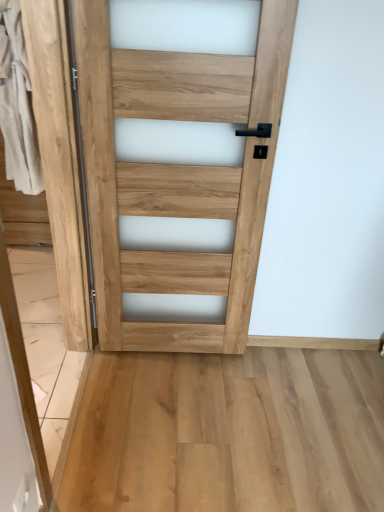
I want to click on natural wood door at center, so click(177, 173).

Describe the element at coordinates (177, 173) in the screenshot. This screenshot has height=512, width=384. I see `natural wood door at center` at that location.

This screenshot has height=512, width=384. What are the coordinates of `natural wood barn door at center` in the screenshot? It's located at (60, 162).

The height and width of the screenshot is (512, 384). What do you see at coordinates (60, 162) in the screenshot? I see `natural wood barn door at center` at bounding box center [60, 162].

In order to face natural wood barn door at center, should I rotate leftwards or rightwards?

Turn left by 19.300 degrees to look at natural wood barn door at center.

Identify the location of natural wood door at center. Image resolution: width=384 pixels, height=512 pixels. (177, 173).

Which is more to the left, natural wood barn door at center or natural wood door at center?

Positioned to the left is natural wood barn door at center.

Relative to natural wood door at center, is natural wood barn door at center in front or behind?

In the image, natural wood barn door at center appears in front of natural wood door at center.

Between point (56, 201) and point (142, 268), which one is positioned behind?

The point (142, 268) is farther from the camera.

From the image's perspective, would you say natural wood barn door at center is positioned over natural wood door at center?

No, from the image's perspective, natural wood barn door at center is not over natural wood door at center.

From a real-world perspective, is natural wood barn door at center positioned over natural wood door at center based on gravity?

No, from a real-world perspective, natural wood barn door at center is not on top of natural wood door at center.

Consider the image. Which object is thinner, natural wood barn door at center or natural wood door at center?

natural wood door at center.

Which of these two, natural wood barn door at center or natural wood door at center, stands taller?

Standing taller between the two is natural wood door at center.

Considering the relative sizes of natural wood barn door at center and natural wood door at center in the image provided, is natural wood barn door at center smaller than natural wood door at center?

No.

Is natural wood barn door at center not within natural wood door at center?

natural wood barn door at center is positioned outside natural wood door at center.

Would you consider natural wood barn door at center to be distant from natural wood door at center?

natural wood barn door at center is near natural wood door at center, not far away.

Could you tell me if natural wood barn door at center is facing natural wood door at center?

Yes, natural wood barn door at center is oriented towards natural wood door at center.

What's the angular difference between natural wood barn door at center and natural wood door at center's facing directions?

88.6 degrees.

Find the location of a particular element. The height and width of the screenshot is (512, 384). barn door in front of the natural wood door at center is located at coordinates [60, 162].

Which object is positioned more to the right, natural wood door at center or natural wood barn door at center?

natural wood door at center is more to the right.

Is the position of natural wood door at center more distant than that of natural wood barn door at center?

Yes, natural wood door at center is behind natural wood barn door at center.

Which is less distant, (113, 278) or (49, 10)?

The point (49, 10) is more forward.

From the image's perspective, is natural wood door at center located above or below natural wood barn door at center?

Based on their image positions, natural wood door at center is located above natural wood barn door at center.

In the scene shown: From a real-world perspective, is natural wood door at center on top of natural wood barn door at center?

Correct, in the physical world, natural wood door at center is higher than natural wood barn door at center.

Can you confirm if natural wood door at center is thinner than natural wood barn door at center?

Yes.

Considering the sizes of objects natural wood door at center and natural wood barn door at center in the image provided, who is taller, natural wood door at center or natural wood barn door at center?

With more height is natural wood door at center.

Considering the sizes of objects natural wood door at center and natural wood barn door at center in the image provided, who is smaller, natural wood door at center or natural wood barn door at center?

Smaller between the two is natural wood door at center.

Which is correct: natural wood door at center is inside natural wood barn door at center, or outside of it?

natural wood door at center cannot be found inside natural wood barn door at center.

Is natural wood door at center next to natural wood barn door at center and touching it?

No, natural wood door at center is not next to natural wood barn door at center.

Consider the image. Could you tell me if natural wood door at center is facing natural wood barn door at center?

No, natural wood door at center is not oriented towards natural wood barn door at center.

Find the location of a particular element. This screenshot has height=512, width=384. door lying on the right of natural wood barn door at center is located at coordinates (177, 173).

Locate an element on the screen. The height and width of the screenshot is (512, 384). door above the natural wood barn door at center (from a real-world perspective) is located at coordinates (177, 173).

Where is `barn door that is on the left side of natural wood door at center`? barn door that is on the left side of natural wood door at center is located at coordinates tap(60, 162).